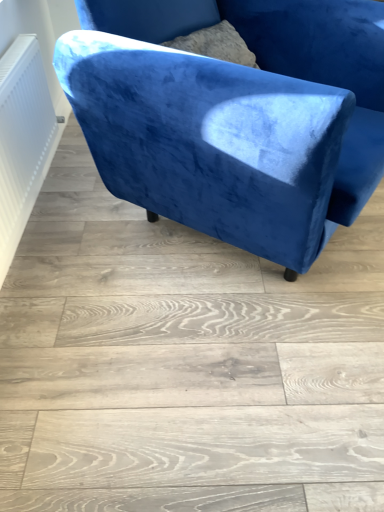
Identify the location of free space in front of velvet blue armchair at upper center. (212, 376).